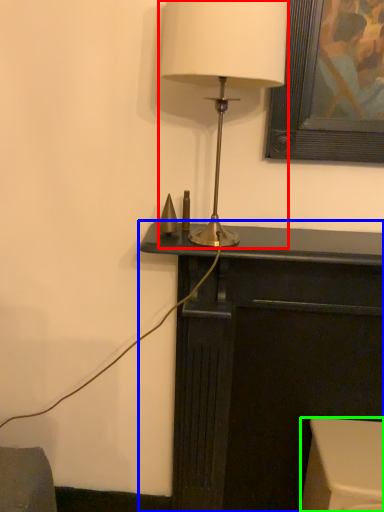
Question: Which object is positioned closest to lamp (highlighted by a red box)? Select from furniture (highlighted by a blue box) and furniture (highlighted by a green box).

Choices:
 (A) furniture
 (B) furniture

Answer: (A)